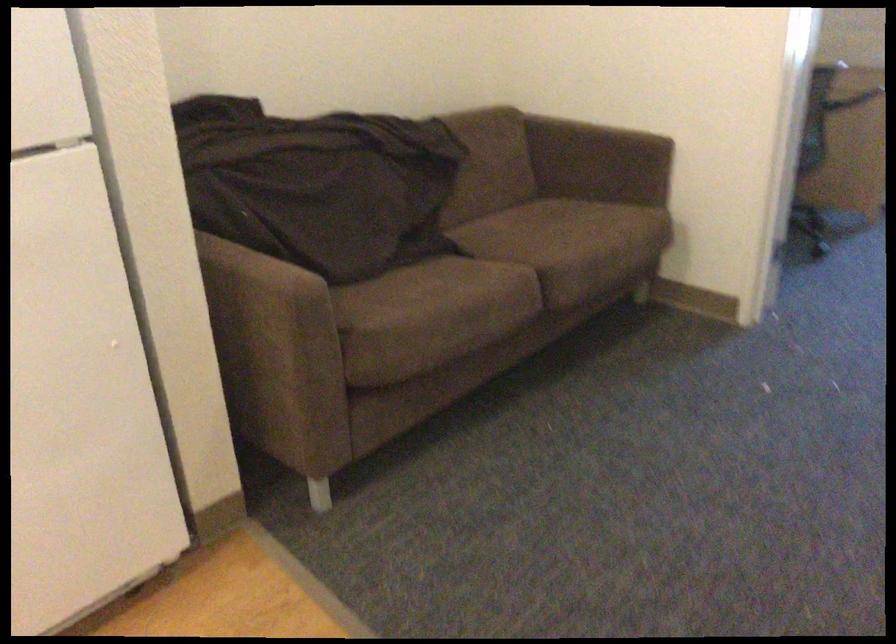
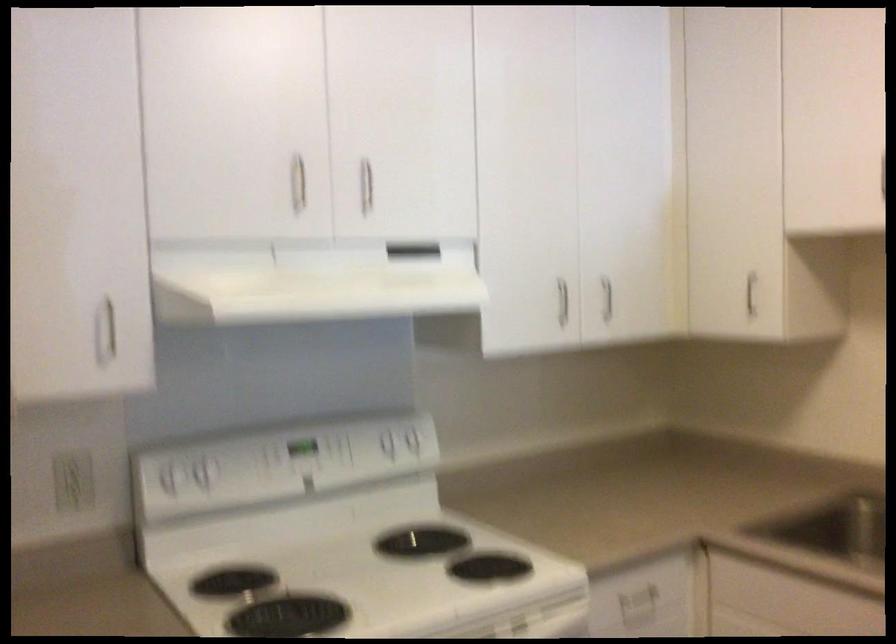
Question: Based on the continuous images, in which direction is the camera rotating? Reply with the corresponding letter.

Choices:
 (A) Left
 (B) Right
 (C) Up
 (D) Down

Answer: (A)